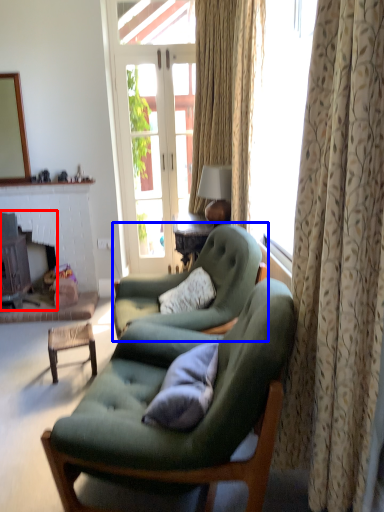
Question: Which object is closer to the camera taking this photo, fireplace (highlighted by a red box) or chair (highlighted by a blue box)?

Choices:
 (A) fireplace
 (B) chair

Answer: (B)